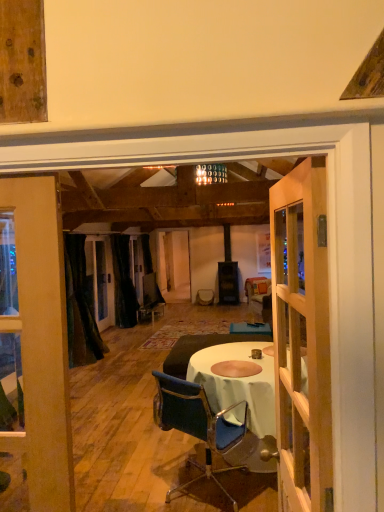
Question: Is black velvet curtain at center, the 2th curtain from the front, not near clear glass window at left?

Choices:
 (A) no
 (B) yes

Answer: (B)

Question: From a real-world perspective, is black velvet curtain at center, the 2th curtain from the front, physically above clear glass window at left?

Choices:
 (A) no
 (B) yes

Answer: (A)

Question: Considering the relative sizes of black velvet curtain at center, which is counted as the first curtain, starting from the back, and clear glass window at left in the image provided, is black velvet curtain at center, which is counted as the first curtain, starting from the back, wider than clear glass window at left?

Choices:
 (A) no
 (B) yes

Answer: (A)

Question: Does black velvet curtain at center, the 2th curtain from the front, have a smaller size compared to clear glass window at left?

Choices:
 (A) no
 (B) yes

Answer: (B)

Question: Is black velvet curtain at center, the 2th curtain from the front, in contact with clear glass window at left?

Choices:
 (A) no
 (B) yes

Answer: (A)

Question: Is point (132, 312) closer or farther from the camera than point (0, 228)?

Choices:
 (A) farther
 (B) closer

Answer: (A)

Question: Considering the positions of black velvet curtain at center, the 2th curtain from the front, and clear glass window at left in the image, is black velvet curtain at center, the 2th curtain from the front, taller or shorter than clear glass window at left?

Choices:
 (A) short
 (B) tall

Answer: (B)

Question: From the image's perspective, relative to clear glass window at left, is black velvet curtain at center, the 2th curtain from the front, above or below?

Choices:
 (A) below
 (B) above

Answer: (B)

Question: Is black velvet curtain at center, the 2th curtain from the front, inside or outside of clear glass window at left?

Choices:
 (A) inside
 (B) outside

Answer: (B)

Question: From the image's perspective, is clear glass window at left located above or below wooden door at center?

Choices:
 (A) below
 (B) above

Answer: (A)

Question: From a real-world perspective, is clear glass window at left positioned above or below wooden door at center?

Choices:
 (A) above
 (B) below

Answer: (B)

Question: Considering the positions of clear glass window at left and wooden door at center in the image, is clear glass window at left taller or shorter than wooden door at center?

Choices:
 (A) tall
 (B) short

Answer: (A)

Question: Is clear glass window at left wider or thinner than wooden door at center?

Choices:
 (A) thin
 (B) wide

Answer: (B)

Question: In terms of width, does wooden door at center look wider or thinner when compared to clear glass window at left?

Choices:
 (A) thin
 (B) wide

Answer: (A)

Question: From the image's perspective, relative to clear glass window at left, is wooden door at center above or below?

Choices:
 (A) below
 (B) above

Answer: (B)